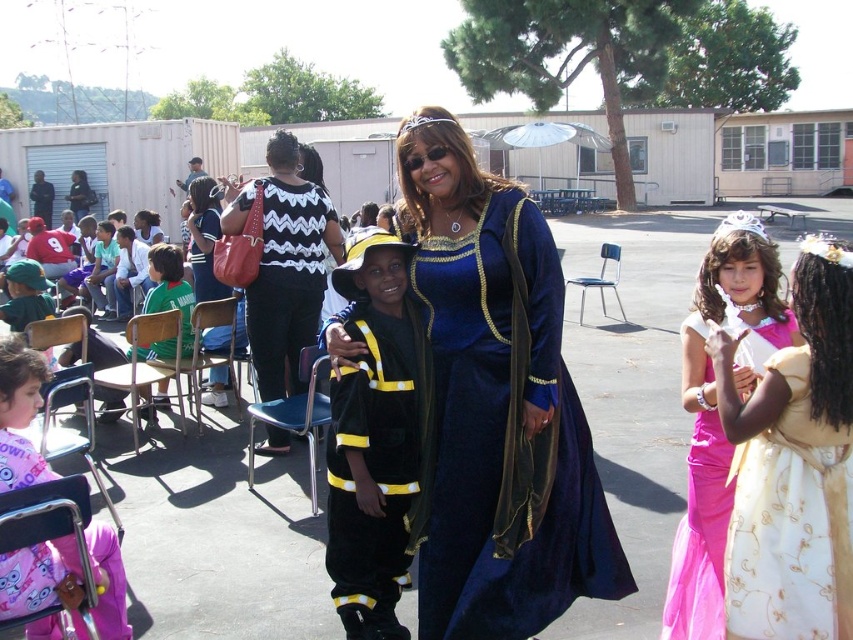
You are standing at the point with coordinates point (161, 300) and want to walk to the point with coordinates point (230, 202). Which direction should you move to reach your destination?

You should move forward to reach point (230, 202) because it is in front of point (161, 300).

You are organizing a clothing donation drive and need to categorize items by size. You have two items to sort today. The first is a black zigzag sweater at center and the second is a green jersey at left. Based on their sizes, which one should be placed in the large bin?

The black zigzag sweater at center should be placed in the large bin since it has a larger size compared to the green jersey at left.

You are taking a photo of the scene and want to focus on both the point at (384, 634) and the point at (41, 554). Which point is closer to your camera?

Point (41, 554) is closer to the camera than point (384, 634).